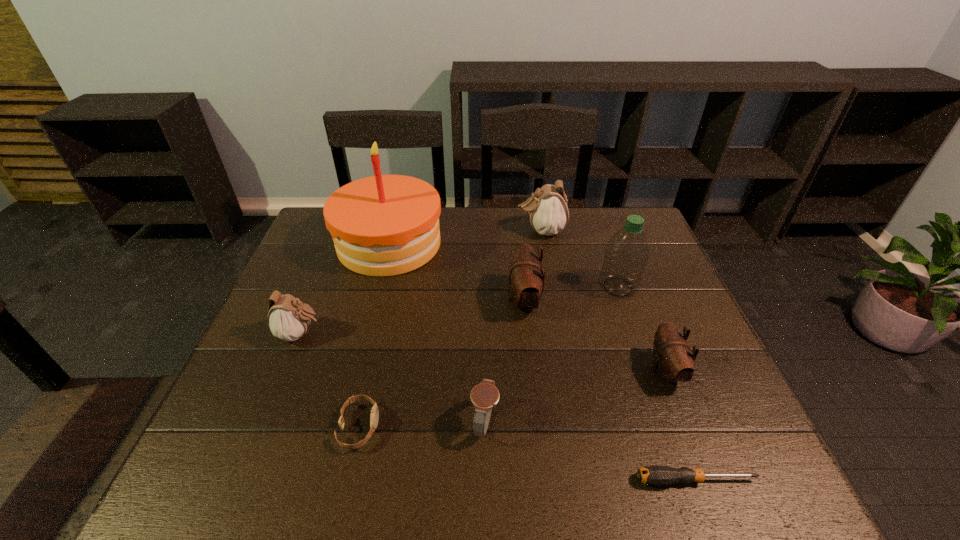
Identify the location of free space between the screwdriver and the right brown pouch. Image resolution: width=960 pixels, height=540 pixels. (681, 426).

I want to click on unoccupied area between the water bottle and the taller watch, so click(x=552, y=355).

Locate an element on the screen. This screenshot has height=540, width=960. free space between the farthest pouch and the smaller brown pouch is located at coordinates (603, 301).

The height and width of the screenshot is (540, 960). What are the coordinates of `free space between the screwdriver and the eighth tallest object` in the screenshot? It's located at (527, 454).

The width and height of the screenshot is (960, 540). I want to click on vacant area between the birthday cake and the smaller white pouch, so click(x=345, y=289).

Where is `vacant space that's between the orange birthday cake and the farthest pouch`? vacant space that's between the orange birthday cake and the farthest pouch is located at coordinates (466, 237).

Locate an element on the screen. empty location between the water bottle and the left white pouch is located at coordinates (459, 310).

Where is `empty space between the screwdriver and the water bottle`? empty space between the screwdriver and the water bottle is located at coordinates (657, 383).

Where is `free area in between the farther brown pouch and the green water bottle`? free area in between the farther brown pouch and the green water bottle is located at coordinates (570, 294).

Point out which object is positioned as the third nearest to the smaller white pouch. Please provide its 2D coordinates. Your answer should be formatted as a tuple, i.e. [(x, y)], where the tuple contains the x and y coordinates of a point satisfying the conditions above.

[(484, 396)]